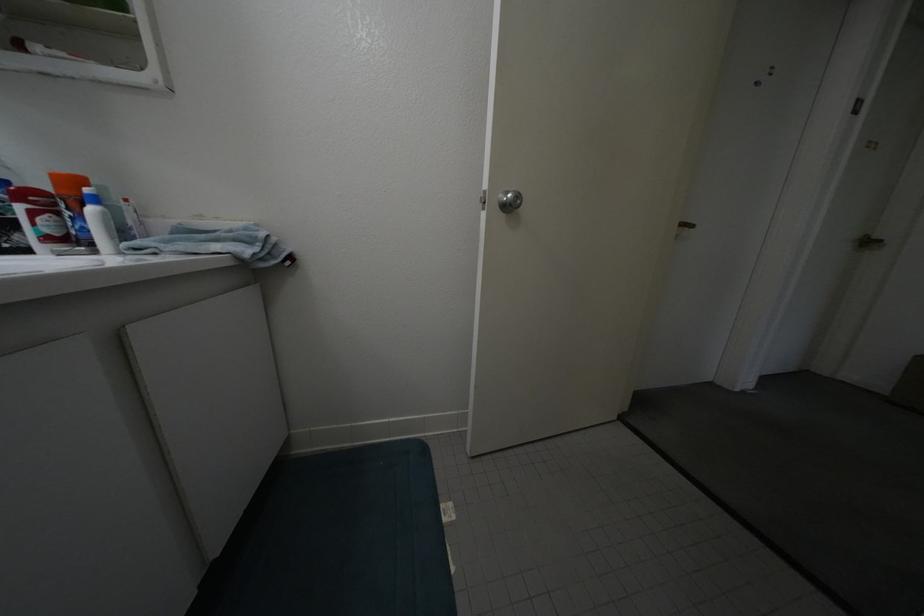
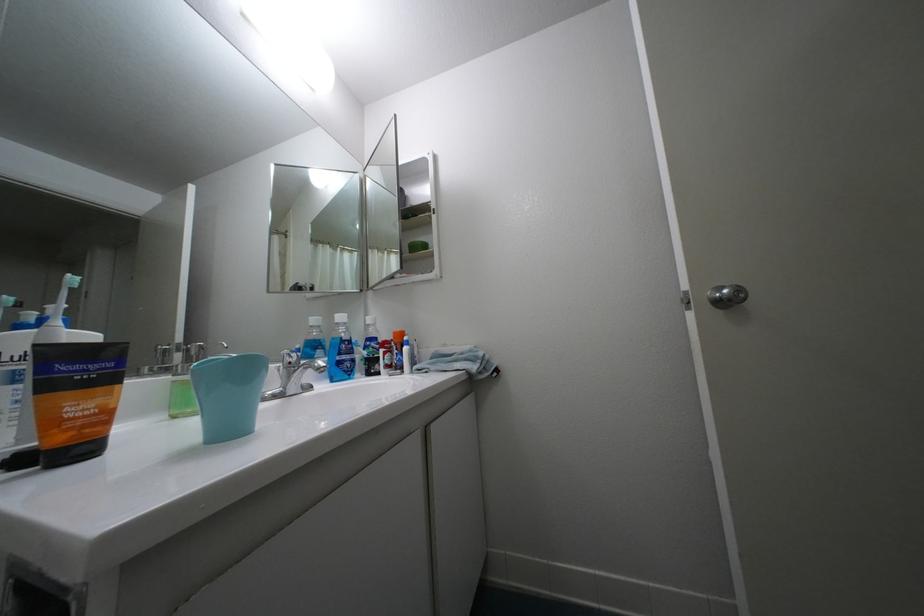
First-person continuous shooting, in which direction is the camera rotating?

The camera rotated toward left-up.